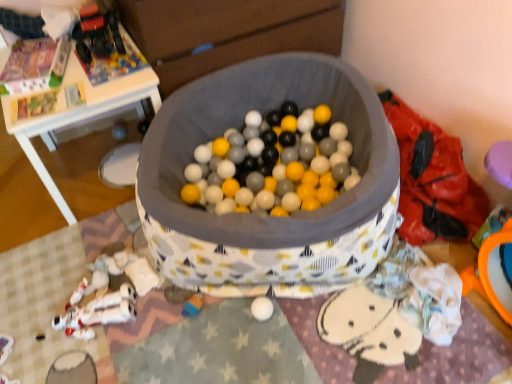
Question: Is metallic plastic toy truck at upper left, which appears as the fourth toy when ordered from the bottom, not inside white plastic table at upper left?

Choices:
 (A) no
 (B) yes

Answer: (B)

Question: Does metallic plastic toy truck at upper left, arranged as the first toy when viewed from the top, have a greater width compared to white plastic table at upper left?

Choices:
 (A) no
 (B) yes

Answer: (A)

Question: Is metallic plastic toy truck at upper left, arranged as the first toy when viewed from the top, positioned behind white plastic table at upper left?

Choices:
 (A) no
 (B) yes

Answer: (B)

Question: Would you consider metallic plastic toy truck at upper left, arranged as the first toy when viewed from the top, to be distant from white plastic table at upper left?

Choices:
 (A) no
 (B) yes

Answer: (A)

Question: Considering the relative sizes of metallic plastic toy truck at upper left, arranged as the first toy when viewed from the top, and white plastic table at upper left in the image provided, is metallic plastic toy truck at upper left, arranged as the first toy when viewed from the top, taller than white plastic table at upper left?

Choices:
 (A) yes
 (B) no

Answer: (B)

Question: From the image's perspective, does metallic plastic toy truck at upper left, arranged as the first toy when viewed from the top, appear higher than white plastic table at upper left?

Choices:
 (A) no
 (B) yes

Answer: (B)

Question: Is white plastic toy at lower left, the 2th toy ordered from the bottom, positioned with its back to white plastic table at upper left?

Choices:
 (A) no
 (B) yes

Answer: (A)

Question: Does white plastic toy at lower left, the 2th toy ordered from the bottom, appear on the left side of white plastic table at upper left?

Choices:
 (A) yes
 (B) no

Answer: (B)

Question: Can you confirm if white plastic toy at lower left, placed as the third toy when sorted from top to bottom, is taller than white plastic table at upper left?

Choices:
 (A) no
 (B) yes

Answer: (A)

Question: Is the depth of white plastic toy at lower left, the 2th toy ordered from the bottom, greater than that of white plastic table at upper left?

Choices:
 (A) yes
 (B) no

Answer: (B)

Question: Does white plastic toy at lower left, the 2th toy ordered from the bottom, appear on the right side of white plastic table at upper left?

Choices:
 (A) no
 (B) yes

Answer: (B)

Question: From the image's perspective, is white plastic toy at lower left, the 2th toy ordered from the bottom, beneath white plastic table at upper left?

Choices:
 (A) yes
 (B) no

Answer: (A)

Question: Are rubberized plastic toy at lower center, positioned as the 1th toy in bottom-to-top order, and white plastic toy at lower left, placed as the third toy when sorted from top to bottom, beside each other?

Choices:
 (A) no
 (B) yes

Answer: (A)